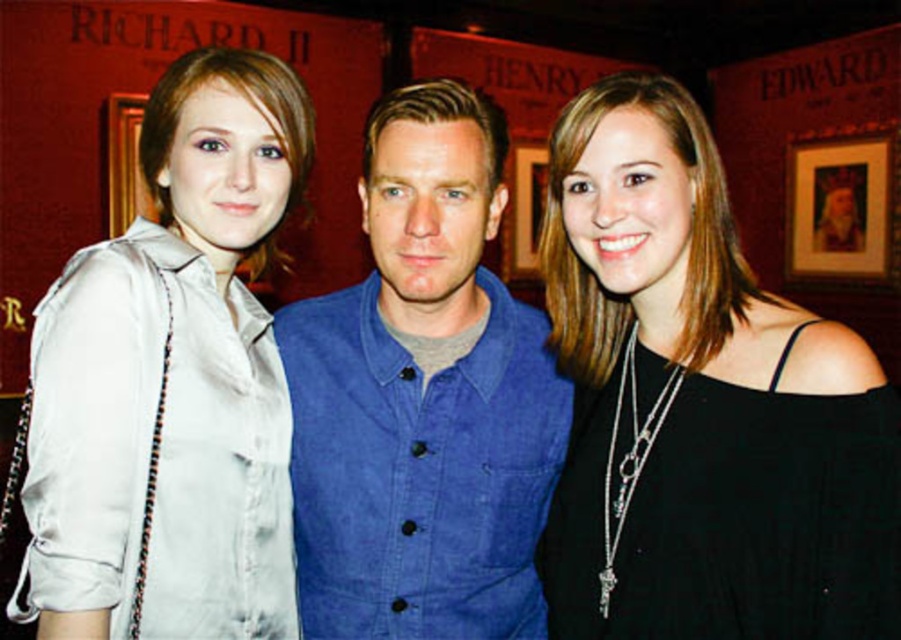
You are organizing a charity event and need to decide which clothing item to display in a narrow showcase. The showcase can only accommodate items that are less than 10 cm in thickness. You have the silky beige blouse at left and the denim vest at center. Based on their thickness, which item is suitable for the showcase?

The silky beige blouse at left is thinner than the denim vest at center, so the silky beige blouse at left is suitable for the showcase as it is less than 10 cm in thickness.

You are attending a formal event and see two people wearing the black matte dress at center and the denim vest at center. Which one is positioned to the right?

The black matte dress at center is positioned to the right of the denim vest at center.